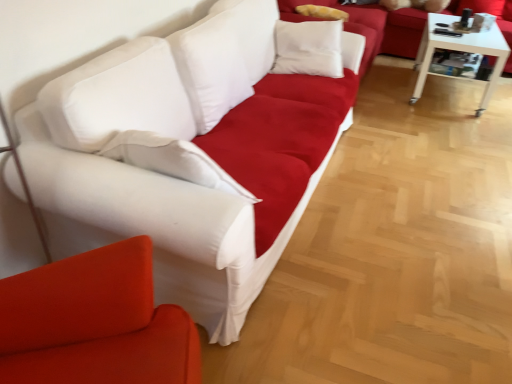
I want to click on free spot in front of white glossy table at right, so click(453, 124).